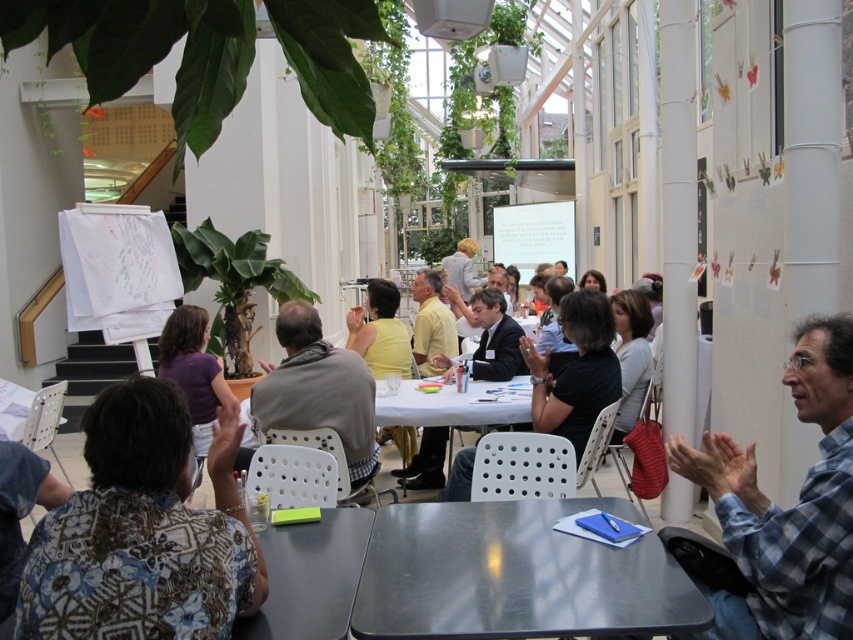
Question: Which object is farther from the camera taking this photo?

Choices:
 (A) white plastic table at center
 (B) blue plaid shirt at center
 (C) black shirt at center

Answer: (A)

Question: Can you confirm if gray fabric jacket at center is wider than white plastic table at center?

Choices:
 (A) no
 (B) yes

Answer: (A)

Question: Which point appears closest to the camera in this image?

Choices:
 (A) (93, 406)
 (B) (341, 369)

Answer: (A)

Question: Which of the following is the farthest from the observer?

Choices:
 (A) (849, 618)
 (B) (62, 531)

Answer: (A)

Question: Is floral fabric shirt at lower left wider than gray fabric jacket at center?

Choices:
 (A) yes
 (B) no

Answer: (B)

Question: Observing the image, what is the correct spatial positioning of metallic gray table at center in reference to blue plaid shirt at center?

Choices:
 (A) right
 (B) left

Answer: (B)